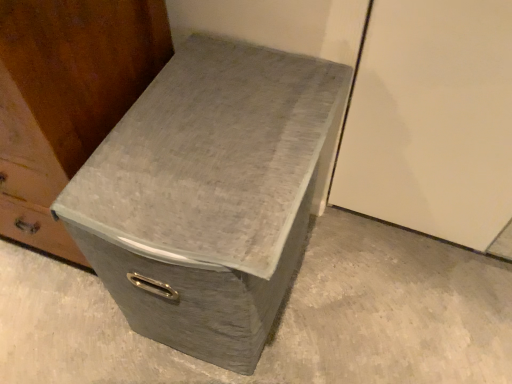
Question: Is gray fabric shoe box at center taller than matte gray storage box at center?

Choices:
 (A) yes
 (B) no

Answer: (B)

Question: Is gray fabric shoe box at center not near matte gray storage box at center?

Choices:
 (A) no
 (B) yes

Answer: (A)

Question: Is gray fabric shoe box at center shorter than matte gray storage box at center?

Choices:
 (A) yes
 (B) no

Answer: (A)

Question: Does gray fabric shoe box at center have a smaller size compared to matte gray storage box at center?

Choices:
 (A) no
 (B) yes

Answer: (B)

Question: Is gray fabric shoe box at center at the left side of matte gray storage box at center?

Choices:
 (A) no
 (B) yes

Answer: (A)

Question: Is gray fabric shoe box at center at the right side of matte gray storage box at center?

Choices:
 (A) yes
 (B) no

Answer: (A)

Question: From a real-world perspective, is gray fabric storage bin at center physically above matte gray storage box at center?

Choices:
 (A) no
 (B) yes

Answer: (A)

Question: Is the position of gray fabric storage bin at center more distant than that of matte gray storage box at center?

Choices:
 (A) yes
 (B) no

Answer: (A)

Question: Could you tell me if gray fabric storage bin at center is turned towards matte gray storage box at center?

Choices:
 (A) no
 (B) yes

Answer: (A)

Question: From the image's perspective, is gray fabric storage bin at center located above matte gray storage box at center?

Choices:
 (A) yes
 (B) no

Answer: (B)

Question: Does gray fabric storage bin at center lie in front of matte gray storage box at center?

Choices:
 (A) yes
 (B) no

Answer: (B)

Question: Does gray fabric storage bin at center contain matte gray storage box at center?

Choices:
 (A) no
 (B) yes

Answer: (A)

Question: Would you consider matte gray storage box at center to be distant from gray fabric storage bin at center?

Choices:
 (A) yes
 (B) no

Answer: (B)